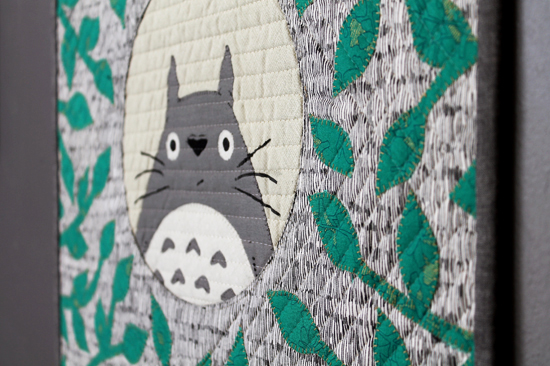
At what (x,y) coordinates should I click in order to perform the action: click on whitish circle quilt around totoro character. Please return your answer as a coordinate pair (x, y). Looking at the image, I should click on coord(198,26).